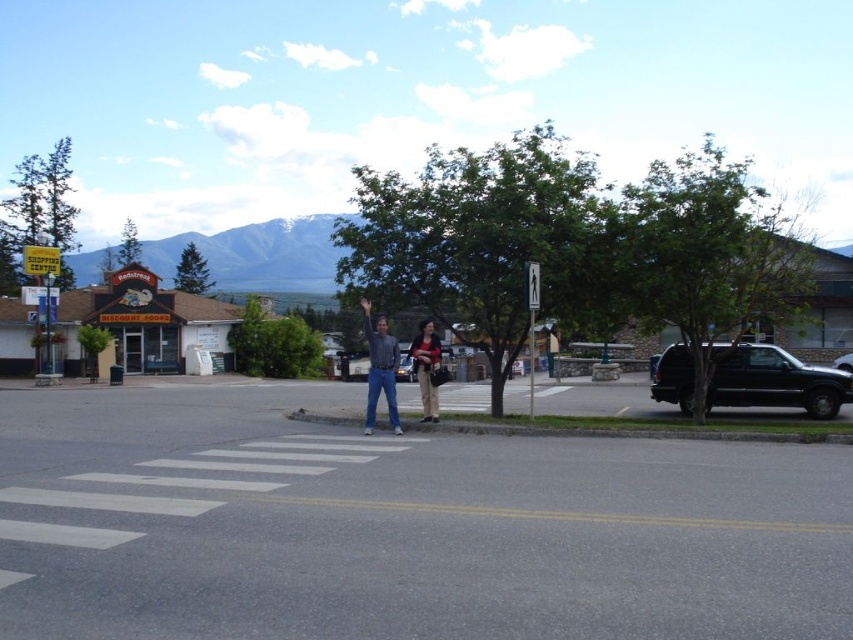
Does snowy mountain range at upper center have a smaller size compared to metallic silver car at center?

No.

The image size is (853, 640). What do you see at coordinates (258, 253) in the screenshot?
I see `snowy mountain range at upper center` at bounding box center [258, 253].

Does point (263, 280) lie in front of point (413, 371)?

That is False.

Identify the location of snowy mountain range at upper center. (258, 253).

At what (x,y) coordinates should I click in order to perform the action: click on snowy mountain range at upper center. Please return your answer as a coordinate pair (x, y). Looking at the image, I should click on (258, 253).

Describe the element at coordinates (258, 253) in the screenshot. The height and width of the screenshot is (640, 853). I see `snowy mountain range at upper center` at that location.

Locate an element on the screen. The width and height of the screenshot is (853, 640). snowy mountain range at upper center is located at coordinates (258, 253).

Between point (289, 243) and point (525, 371), which one is positioned in front?

Point (525, 371)

Does snowy mountain range at upper center have a greater width compared to black matte suv at center?

Indeed, snowy mountain range at upper center has a greater width compared to black matte suv at center.

Is point (231, 289) closer to viewer compared to point (511, 362)?

No, it is behind (511, 362).

Where is `snowy mountain range at upper center`? The width and height of the screenshot is (853, 640). snowy mountain range at upper center is located at coordinates (258, 253).